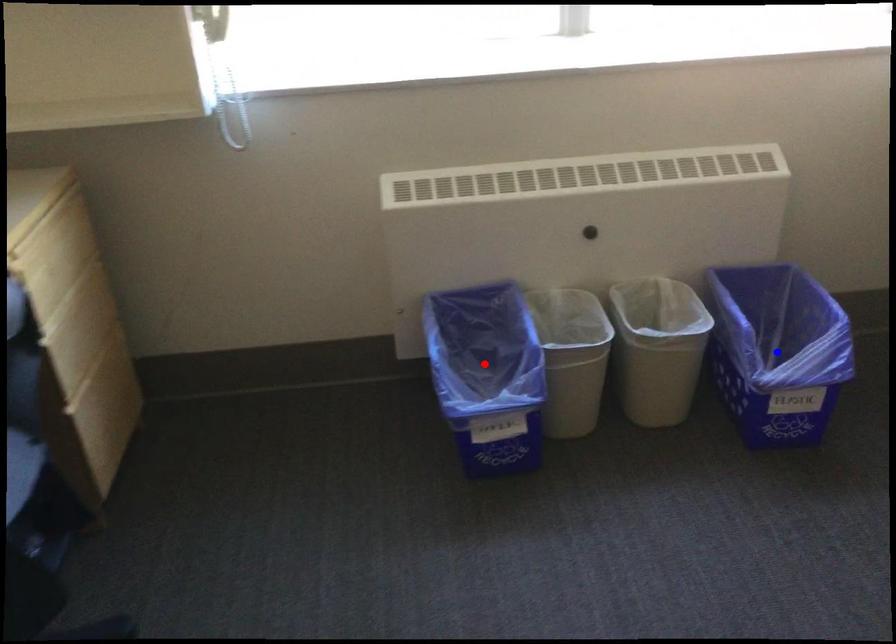
Question: Two points are marked on the image. Which point is closer to the camera?

Choices:
 (A) Blue point is closer.
 (B) Red point is closer.

Answer: (B)